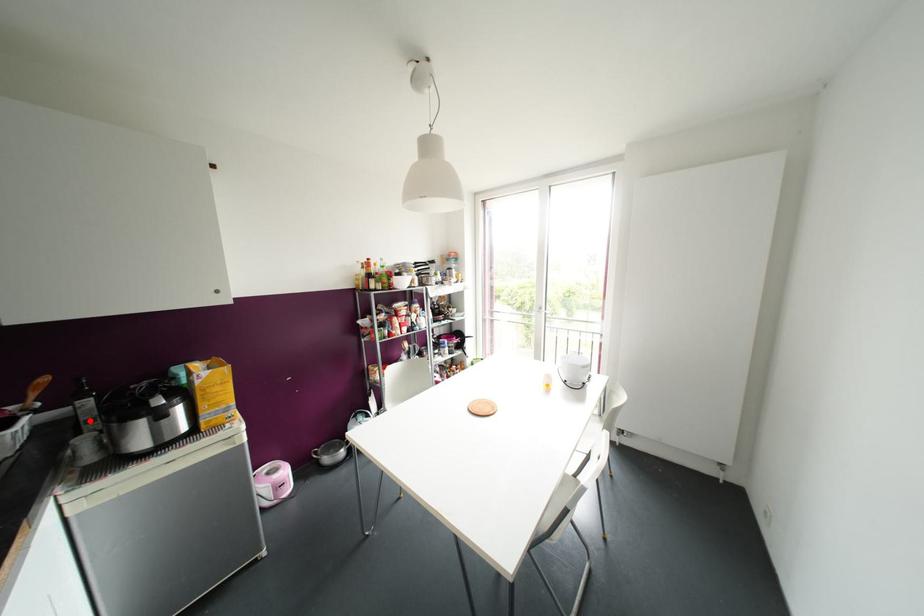
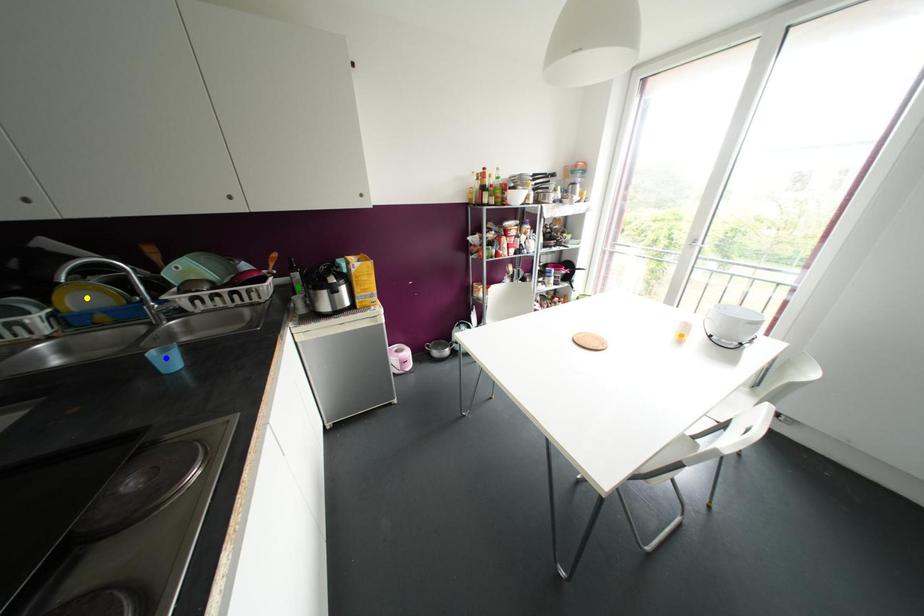
Question: I am providing you with two images of the same scene from different viewpoints. A red point is marked on the first image. You are given multiple points on the second image. In image 2, which mark is for the same physical point as the one in image 1?

Choices:
 (A) blue point
 (B) yellow point
 (C) green point

Answer: (C)